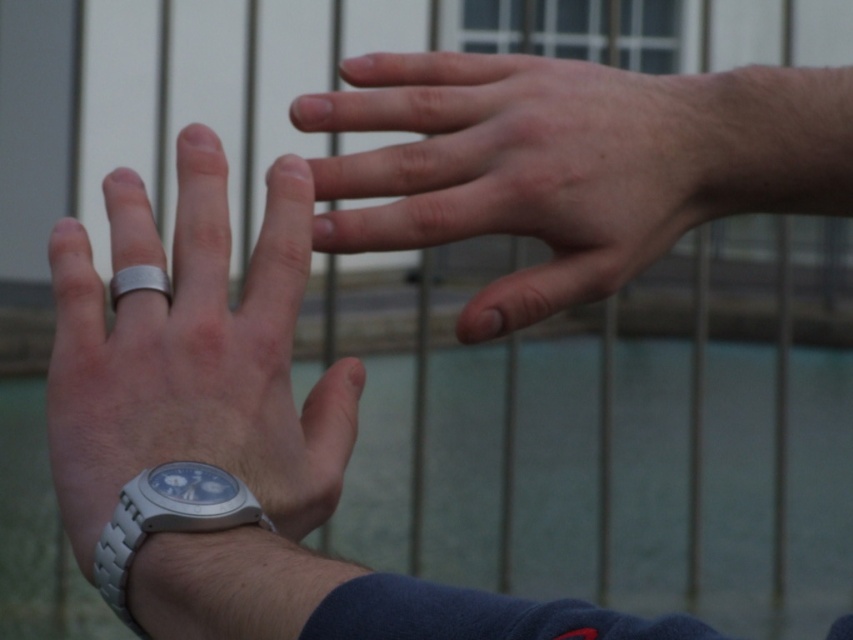
Question: Can you confirm if silver metallic watch at left is positioned below silver metallic watch at lower left?

Choices:
 (A) yes
 (B) no

Answer: (B)

Question: Is silver metallic watch at left wider than silver metallic ring at center?

Choices:
 (A) yes
 (B) no

Answer: (A)

Question: Does silver metallic watch at left lie in front of silver metallic ring at center?

Choices:
 (A) yes
 (B) no

Answer: (A)

Question: Estimate the real-world distances between objects in this image. Which object is farther from the silver metallic watch at left?

Choices:
 (A) silver metallic ring at center
 (B) smooth skin hand at upper center

Answer: (B)

Question: Estimate the real-world distances between objects in this image. Which object is farther from the silver metallic watch at left?

Choices:
 (A) smooth skin hand at upper center
 (B) silver metallic watch at lower left

Answer: (A)

Question: Which of the following is the closest to the observer?

Choices:
 (A) silver metallic watch at lower left
 (B) smooth skin hand at upper center

Answer: (A)